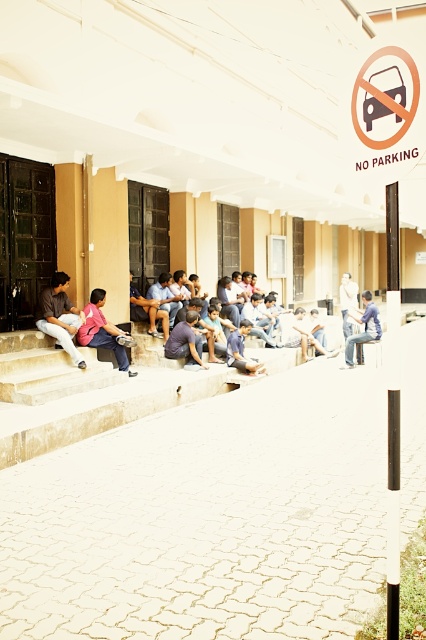
Which of these two, matte brown shirt at lower left or blue denim jeans at center, stands taller?

matte brown shirt at lower left

Is matte brown shirt at lower left smaller than blue denim jeans at center?

Correct, matte brown shirt at lower left occupies less space than blue denim jeans at center.

Does point (69, 321) come farther from viewer compared to point (370, 337)?

No, (69, 321) is closer to viewer.

Identify the location of matte brown shirt at lower left. (60, 316).

Which is more to the right, matte brown shirt at lower left or pink fabric shirt at lower left?

pink fabric shirt at lower left

The height and width of the screenshot is (640, 426). What do you see at coordinates (60, 316) in the screenshot?
I see `matte brown shirt at lower left` at bounding box center [60, 316].

This screenshot has width=426, height=640. What do you see at coordinates (60, 316) in the screenshot?
I see `matte brown shirt at lower left` at bounding box center [60, 316].

Where is `matte brown shirt at lower left`? This screenshot has width=426, height=640. matte brown shirt at lower left is located at coordinates (60, 316).

Between black glossy pole at center and pink fabric shirt at lower left, which one has more height?

With more height is black glossy pole at center.

Between point (397, 380) and point (97, 298), which one is positioned in front?

Positioned in front is point (397, 380).

Does point (393, 436) lie in front of point (115, 344)?

Yes, point (393, 436) is in front of point (115, 344).

At what (x,y) coordinates should I click in order to perform the action: click on black glossy pole at center. Please return your answer as a coordinate pair (x, y). The height and width of the screenshot is (640, 426). Looking at the image, I should click on (393, 406).